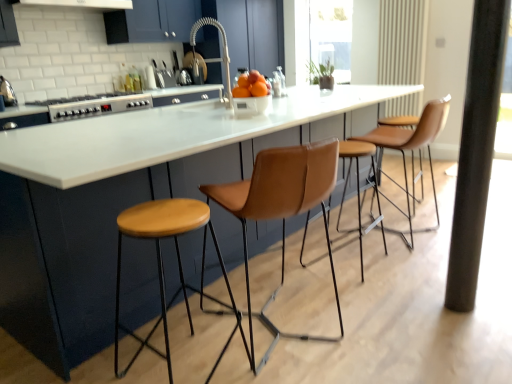
You are a GUI agent. You are given a task and a screenshot of the screen. Output one action in this format:
    pyautogui.click(x=<x>, y=<y>)
    Task: Click on the vacant space in between leather at center, the 2th chair when ordered from right to left, and black matte pillar at right
    Image resolution: width=512 pixels, height=384 pixels.
    Given the screenshot: What is the action you would take?
    pyautogui.click(x=385, y=314)